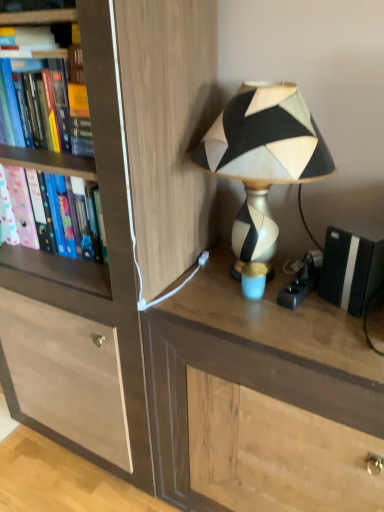
Question: Is black and white geometric lampshade at upper right facing towards pink matte folder at left, the second book when ordered from top to bottom?

Choices:
 (A) no
 (B) yes

Answer: (A)

Question: From a real-world perspective, is black and white geometric lampshade at upper right located beneath pink matte folder at left, the second book when ordered from top to bottom?

Choices:
 (A) no
 (B) yes

Answer: (A)

Question: Can you confirm if black and white geometric lampshade at upper right is smaller than pink matte folder at left, the second book when ordered from top to bottom?

Choices:
 (A) yes
 (B) no

Answer: (B)

Question: Is black and white geometric lampshade at upper right looking in the opposite direction of pink matte folder at left, the 1th book when ordered from bottom to top?

Choices:
 (A) yes
 (B) no

Answer: (B)

Question: Considering the relative positions of black and white geometric lampshade at upper right and pink matte folder at left, the 1th book when ordered from bottom to top, in the image provided, is black and white geometric lampshade at upper right to the right of pink matte folder at left, the 1th book when ordered from bottom to top, from the viewer's perspective?

Choices:
 (A) yes
 (B) no

Answer: (A)

Question: From the image's perspective, is black matte speaker at right positioned above or below black and white geometric lampshade at upper right?

Choices:
 (A) below
 (B) above

Answer: (A)

Question: From a real-world perspective, is black matte speaker at right above or below black and white geometric lampshade at upper right?

Choices:
 (A) below
 (B) above

Answer: (A)

Question: Does point (382, 247) appear closer or farther from the camera than point (228, 173)?

Choices:
 (A) closer
 (B) farther

Answer: (A)

Question: Which is correct: black matte speaker at right is inside black and white geometric lampshade at upper right, or outside of it?

Choices:
 (A) inside
 (B) outside

Answer: (B)

Question: Is point (271, 151) positioned closer to the camera than point (13, 66)?

Choices:
 (A) closer
 (B) farther

Answer: (A)

Question: Visually, is black and white geometric lampshade at upper right positioned to the left or to the right of hardcover book at left, which is the second book in bottom-to-top order?

Choices:
 (A) left
 (B) right

Answer: (B)

Question: Is black and white geometric lampshade at upper right bigger or smaller than hardcover book at left, positioned as the 1th book in top-to-bottom order?

Choices:
 (A) small
 (B) big

Answer: (B)

Question: Is black and white geometric lampshade at upper right situated inside hardcover book at left, which is the second book in bottom-to-top order, or outside?

Choices:
 (A) outside
 (B) inside

Answer: (A)

Question: Does point (44, 355) appear closer or farther from the camera than point (39, 176)?

Choices:
 (A) closer
 (B) farther

Answer: (B)

Question: Looking at the image, does wooden cabinet at center seem bigger or smaller compared to pink matte folder at left, the second book when ordered from top to bottom?

Choices:
 (A) big
 (B) small

Answer: (A)